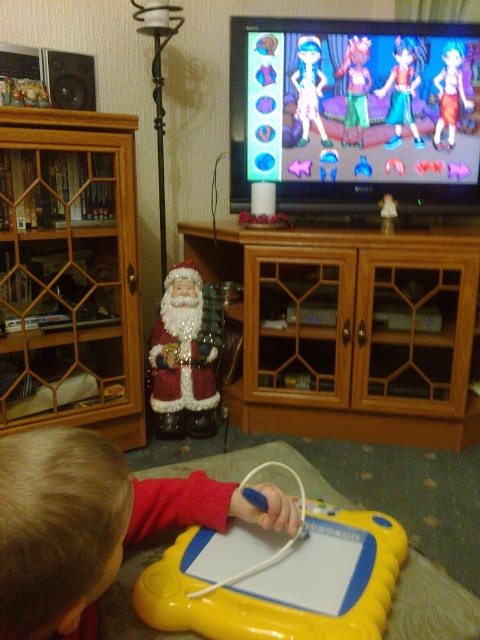
Is wooden cabinet at center smaller than shiny plastic toy at center?

Actually, wooden cabinet at center might be larger than shiny plastic toy at center.

Between wooden cabinet at center and shiny plastic toy at center, which one is positioned higher?

shiny plastic toy at center is above.

At what (x,y) coordinates should I click in order to perform the action: click on wooden cabinet at center. Please return your answer as a coordinate pair (x, y). This screenshot has width=480, height=640. Looking at the image, I should click on (348, 333).

You are a GUI agent. You are given a task and a screenshot of the screen. Output one action in this format:
    pyautogui.click(x=<x>, y=<y>)
    Task: Click on the wooden cabinet at center
    
    Given the screenshot: What is the action you would take?
    pyautogui.click(x=348, y=333)

Can you confirm if satin-like red santa claus at center is smaller than shiny plastic figure at upper center?

No.

Which is in front, point (180, 364) or point (299, 145)?

Positioned in front is point (180, 364).

Locate an element on the screen. The height and width of the screenshot is (640, 480). satin-like red santa claus at center is located at coordinates (186, 356).

Based on the photo, is smooth yellow tablet at lower center to the left of shiny plastic figure at upper center from the viewer's perspective?

Yes, smooth yellow tablet at lower center is to the left of shiny plastic figure at upper center.

Is point (72, 552) positioned behind point (322, 138)?

That is False.

This screenshot has width=480, height=640. Identify the location of smooth yellow tablet at lower center. (92, 522).